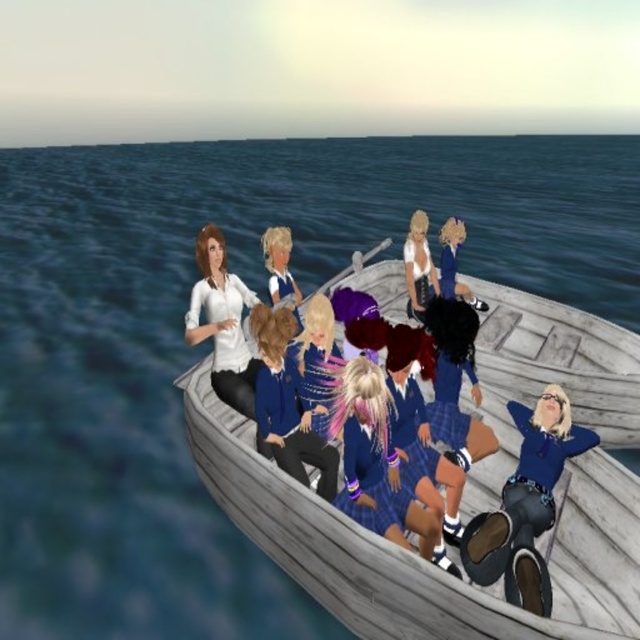
Which is behind, point (378, 412) or point (216, 298)?

The point (216, 298) is more distant.

Is plaid fabric skirt at center in front of matte white shirt at upper left?

That is True.

Is point (385, 440) positioned behind point (253, 371)?

No, (385, 440) is in front of (253, 371).

What are the coordinates of `plaid fabric skirt at center` in the screenshot? It's located at (376, 464).

Does shiny blue jacket at center have a lesser height compared to shiny purple hair at center?

No, shiny blue jacket at center is not shorter than shiny purple hair at center.

Is shiny blue jacket at center in front of shiny purple hair at center?

Yes, shiny blue jacket at center is in front of shiny purple hair at center.

Is point (260, 371) positioned before point (428, 404)?

Yes, point (260, 371) is in front of point (428, 404).

Find the location of `shiny blue jacket at center`. shiny blue jacket at center is located at coordinates point(288,404).

How distant is blue denim jeans at lower right from white glossy tank top at center?

8.94 feet

Does blue denim jeans at lower right have a larger size compared to white glossy tank top at center?

No, blue denim jeans at lower right is not bigger than white glossy tank top at center.

Locate an element on the screen. This screenshot has width=640, height=640. blue denim jeans at lower right is located at coordinates (525, 502).

Image resolution: width=640 pixels, height=640 pixels. What are the coordinates of `blue denim jeans at lower right` in the screenshot? It's located at (525, 502).